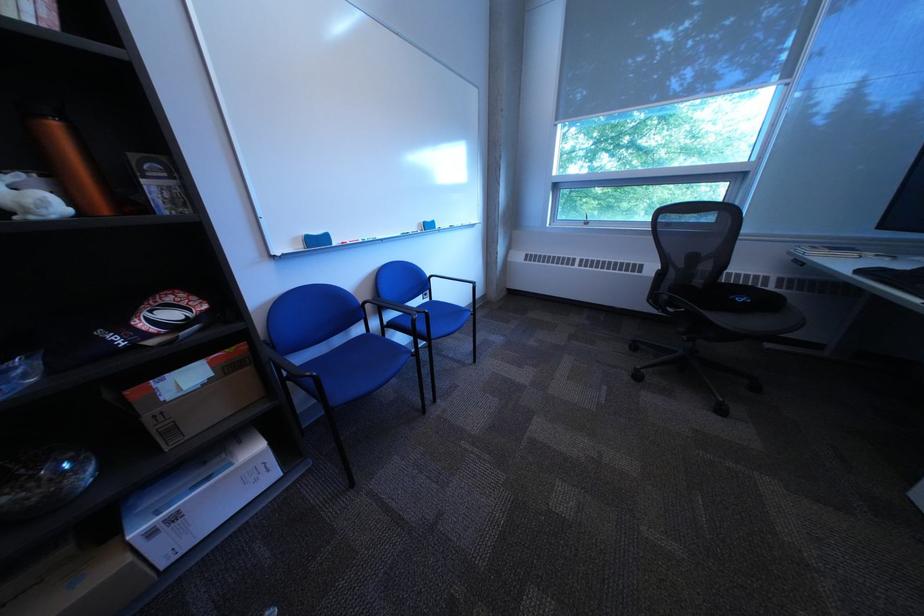
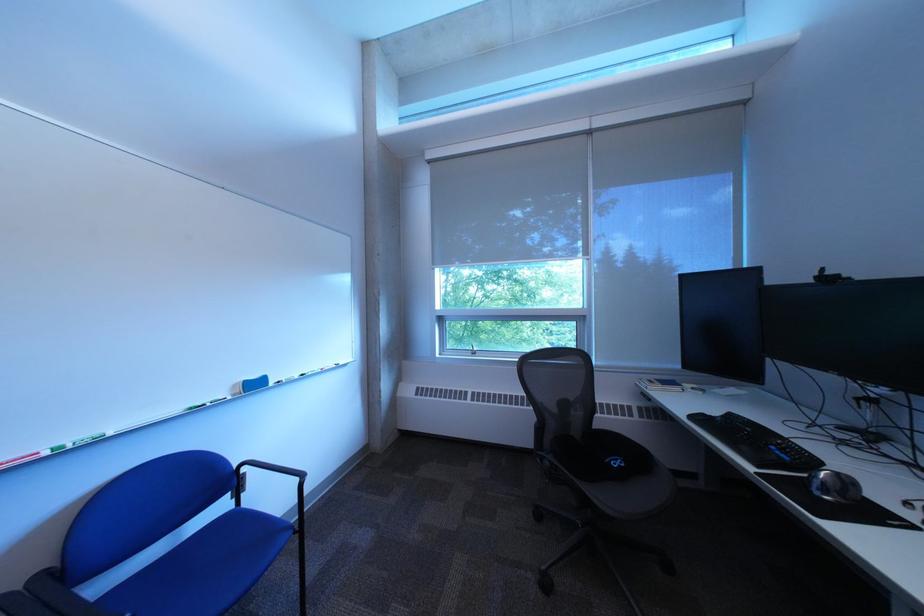
In the second image, find the point that corresponds to pixel 434 225 in the first image.

(249, 387)